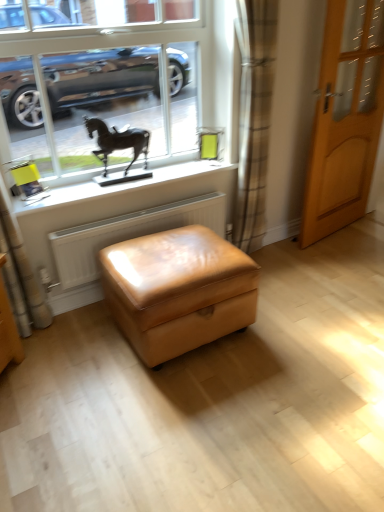
Question: From their relative heights in the image, would you say leather ottoman at center is taller or shorter than plaid fabric curtain at center?

Choices:
 (A) tall
 (B) short

Answer: (B)

Question: Is point (231, 272) positioned closer to the camera than point (243, 208)?

Choices:
 (A) farther
 (B) closer

Answer: (B)

Question: Estimate the real-world distances between objects in this image. Which object is farther from the white matte window sill at upper center?

Choices:
 (A) plaid fabric curtain at center
 (B) leather ottoman at center
 (C) white textured radiator at lower center
 (D) metallic horse statue at upper left
 (E) light brown wooden door at right

Answer: (E)

Question: Estimate the real-world distances between objects in this image. Which object is farther from the plaid fabric curtain at center?

Choices:
 (A) metallic horse statue at upper left
 (B) black metal horse at upper center
 (C) light brown wooden door at right
 (D) white textured radiator at lower center
 (E) leather ottoman at center

Answer: (E)